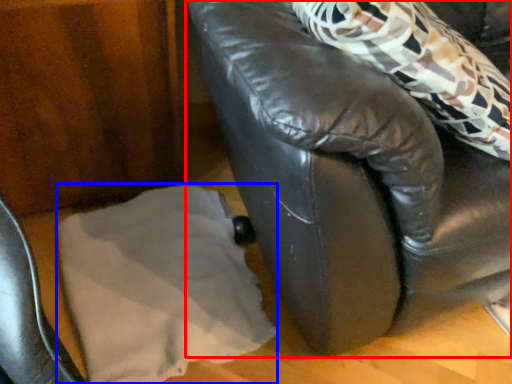
Question: Which point is further to the camera, furniture (highlighted by a red box) or linen (highlighted by a blue box)?

Choices:
 (A) furniture
 (B) linen

Answer: (B)